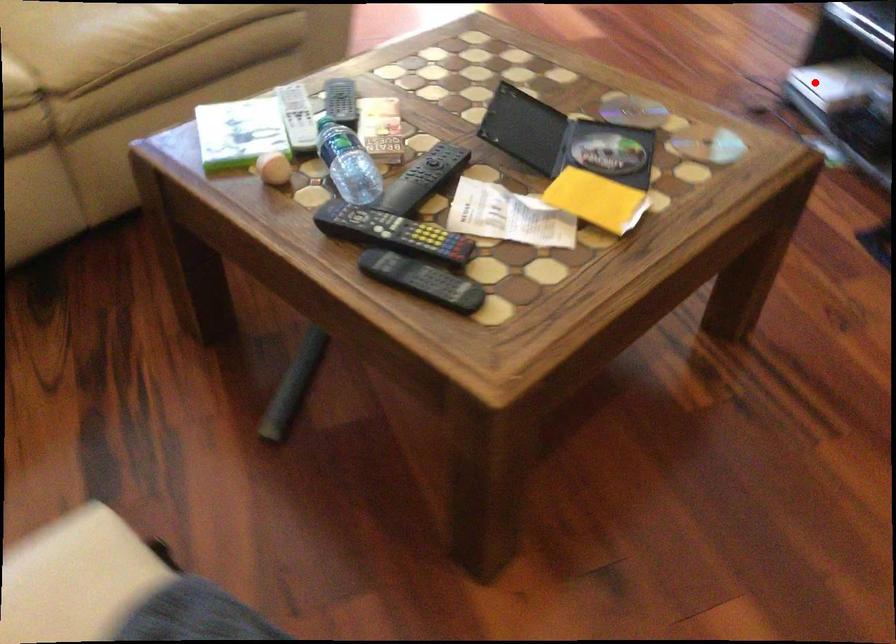
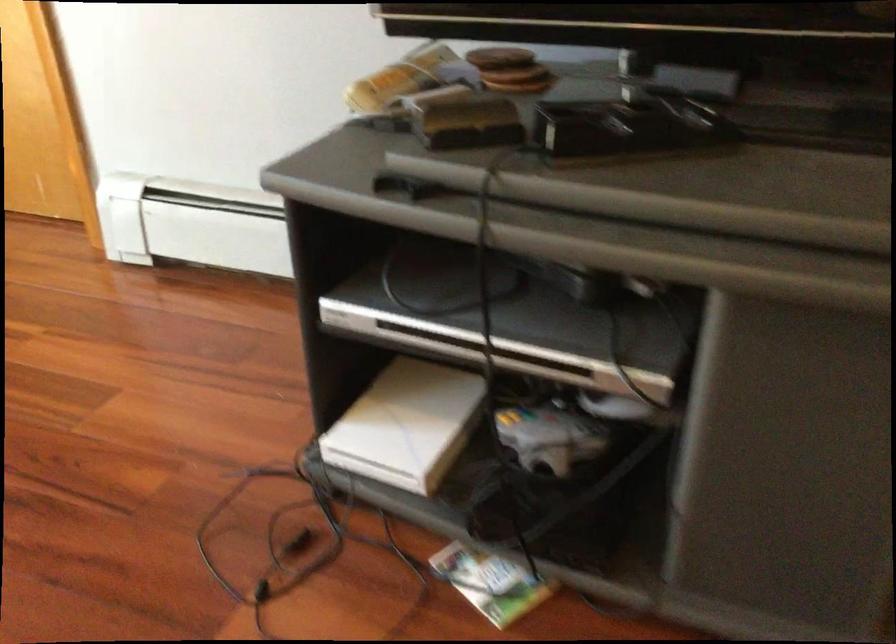
Question: I am providing you with two images of the same scene from different viewpoints. In image1, a red point is highlighted. Considering the same 3D point in image2, which of the following is correct?

Choices:
 (A) It is closer
 (B) It is farther

Answer: (A)